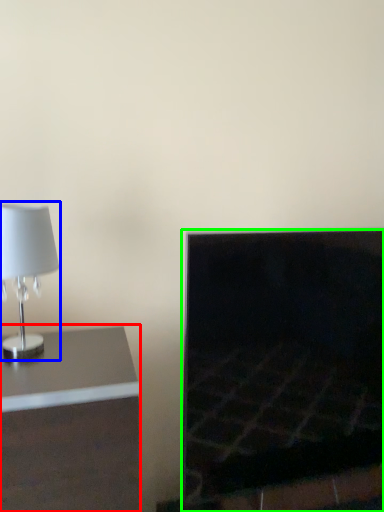
Question: Which is nearer to the furniture (highlighted by a red box)? lamp (highlighted by a blue box) or fireplace (highlighted by a green box).

Choices:
 (A) lamp
 (B) fireplace

Answer: (A)